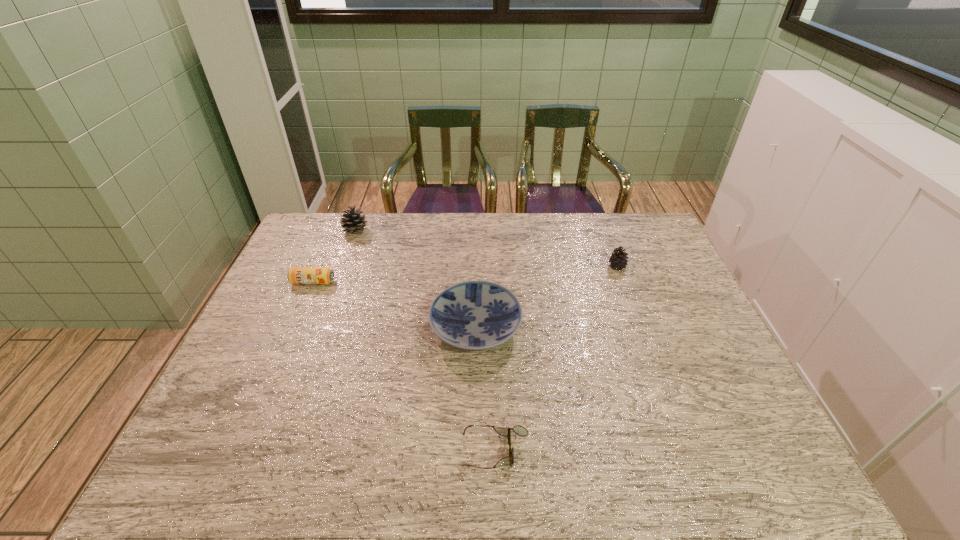
Locate an element on the screen. The image size is (960, 540). object present at the far left corner is located at coordinates (352, 222).

You are a GUI agent. You are given a task and a screenshot of the screen. Output one action in this format:
    pyautogui.click(x=<x>, y=<y>)
    Task: Click on the free space at the far edge of the desktop
    
    Given the screenshot: What is the action you would take?
    pyautogui.click(x=492, y=224)

The height and width of the screenshot is (540, 960). What are the coordinates of `free space at the near edge of the desktop` in the screenshot? It's located at (544, 468).

At what (x,y) coordinates should I click in order to perform the action: click on vacant space at the right edge of the desktop. Please return your answer as a coordinate pair (x, y). This screenshot has width=960, height=540. Looking at the image, I should click on (692, 323).

The width and height of the screenshot is (960, 540). In the image, there is a desktop. What are the coordinates of `vacant area at the far left corner` in the screenshot? It's located at (298, 248).

This screenshot has width=960, height=540. What are the coordinates of `free space at the near left corner of the desktop` in the screenshot? It's located at (227, 480).

Locate an element on the screen. free space at the far right corner of the desktop is located at coordinates (633, 247).

Where is `vacant point at the near right corner`? vacant point at the near right corner is located at coordinates 735,454.

Identify the location of vacant area that lies between the nearer pinecone and the plate. (546, 298).

You are a GUI agent. You are given a task and a screenshot of the screen. Output one action in this format:
    pyautogui.click(x=<x>, y=<y>)
    Task: Click on the vacant space that is in between the plate and the farthest object
    This screenshot has height=540, width=960.
    Given the screenshot: What is the action you would take?
    (x=416, y=280)